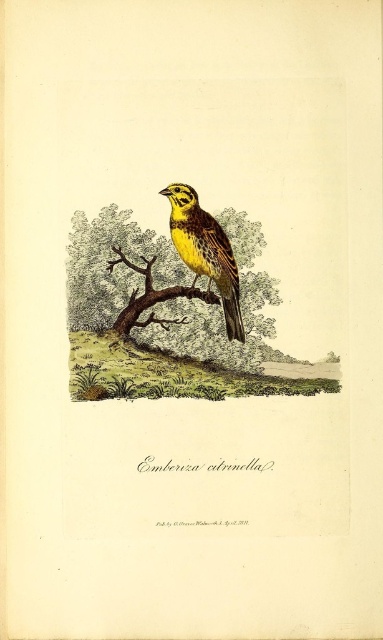
You are an ornithologist studying the spatial arrangement of birds in their natural habitats. In the image provided, there is a point marked at coordinates point (166, 289). Based on the scene description, what object does this point most likely correspond to?

The point (166, 289) corresponds to the brown textured branch at center.